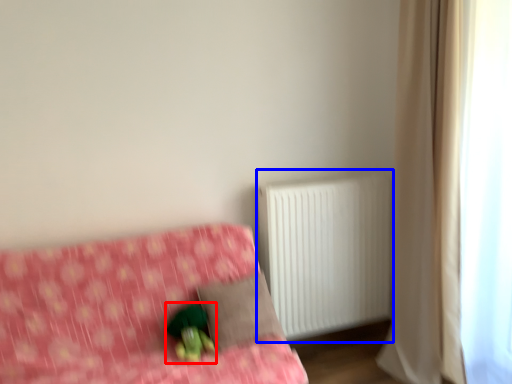
Question: Which of the following is the farthest to the observer, figurine (highlighted by a red box) or radiator (highlighted by a blue box)?

Choices:
 (A) figurine
 (B) radiator

Answer: (B)